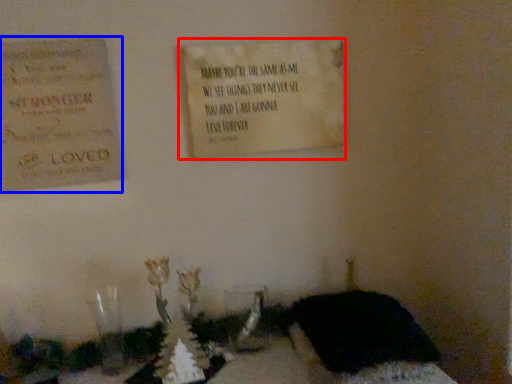
Question: Among these objects, which one is nearest to the camera, notice (highlighted by a red box) or cardboard (highlighted by a blue box)?

Choices:
 (A) notice
 (B) cardboard

Answer: (B)